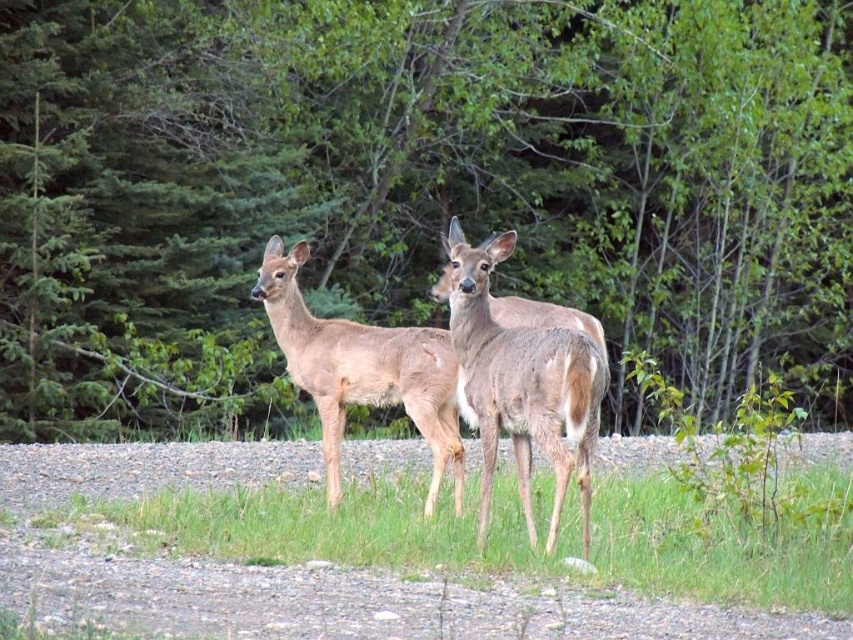
Question: Does green leafy forest at center lie behind brown fur deer at center?

Choices:
 (A) yes
 (B) no

Answer: (A)

Question: Can you confirm if brown matte fur at center is smaller than brown fur deer at center?

Choices:
 (A) yes
 (B) no

Answer: (B)

Question: Which point is farther to the camera?

Choices:
 (A) (299, 353)
 (B) (314, 19)

Answer: (B)

Question: Which of the following is the closest to the observer?

Choices:
 (A) brown fur deer at center
 (B) green leafy forest at center

Answer: (A)

Question: Which is farther from the brown fur deer at center?

Choices:
 (A) brown matte fur at center
 (B) green leafy forest at center

Answer: (B)

Question: In this image, where is brown matte fur at center located relative to brown fur deer at center?

Choices:
 (A) right
 (B) left

Answer: (A)